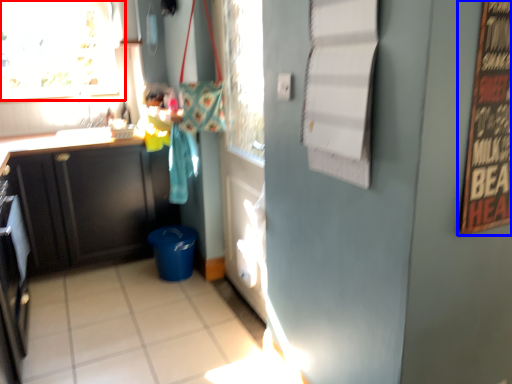
Question: Which object is closer to the camera taking this photo, window (highlighted by a red box) or bulletin board (highlighted by a blue box)?

Choices:
 (A) window
 (B) bulletin board

Answer: (B)